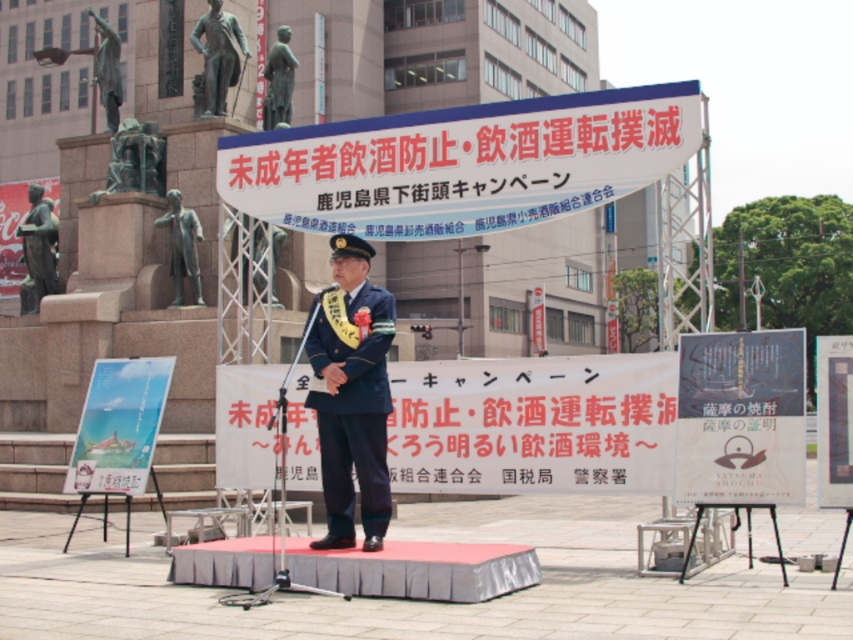
You are a city planner reviewing this event setup. The white paper sign at upper center and the white paper banner at center are both important for the event. Based on their positions, which one is closer to the speaker on stage?

The white paper sign at upper center is closer to the speaker on stage because the white paper banner at center is behind it.